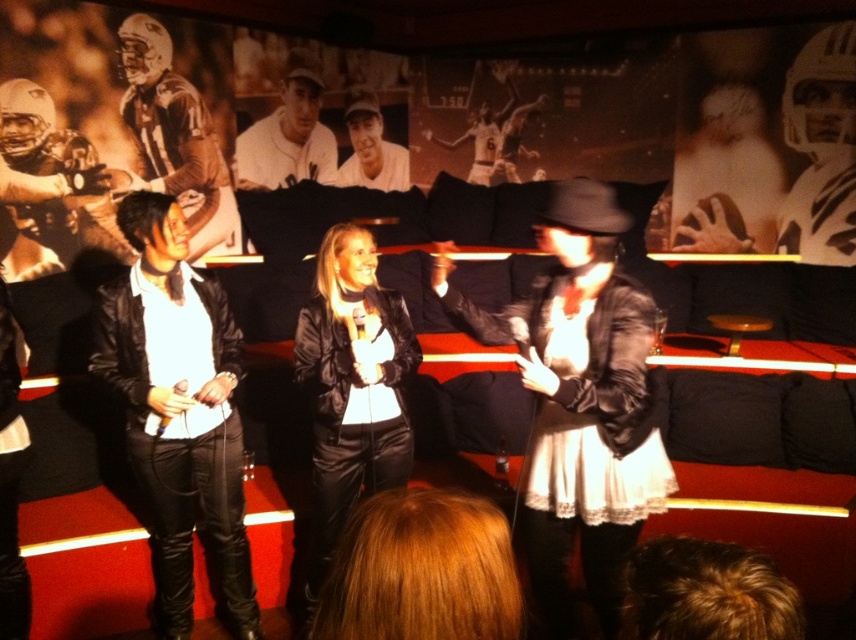
Who is higher up, white jersey at upper center or white baseball cap at center?

white baseball cap at center is higher up.

Image resolution: width=856 pixels, height=640 pixels. I want to click on white jersey at upper center, so click(288, 132).

At what (x,y) coordinates should I click in order to perform the action: click on matte black jacket at left. Please return your answer as a coordinate pair (x, y). The height and width of the screenshot is (640, 856). Looking at the image, I should click on (177, 412).

Is point (232, 497) positioned after point (483, 141)?

No.

This screenshot has height=640, width=856. Describe the element at coordinates (177, 412) in the screenshot. I see `matte black jacket at left` at that location.

Identify the location of matte black jacket at left. (177, 412).

Is matte black jacket at left to the left of white baseball cap at center from the viewer's perspective?

Indeed, matte black jacket at left is positioned on the left side of white baseball cap at center.

What are the coordinates of `matte black jacket at left` in the screenshot? It's located at (177, 412).

Image resolution: width=856 pixels, height=640 pixels. I want to click on matte black jacket at left, so click(177, 412).